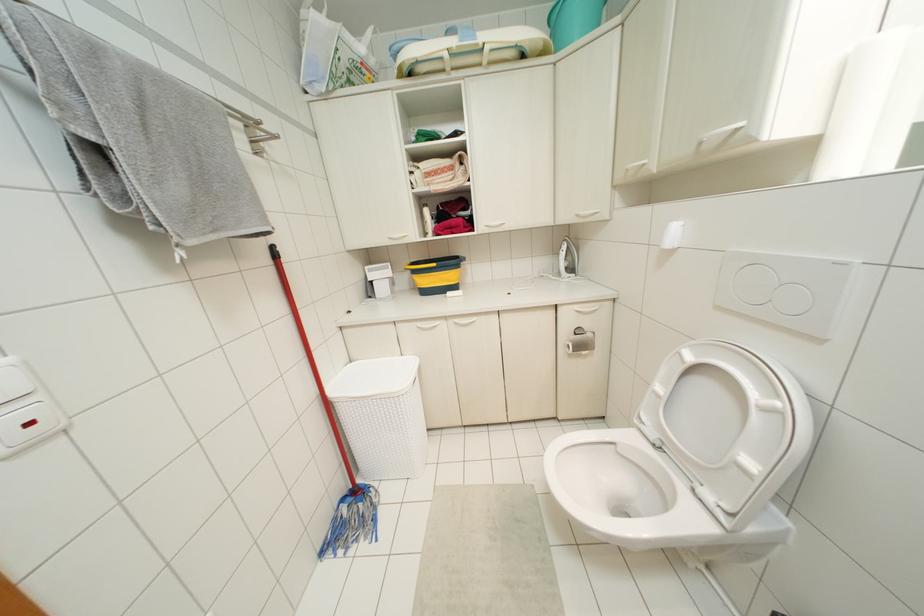
Identify the location of yellow bucket handle. Image resolution: width=924 pixels, height=616 pixels. (421, 264).